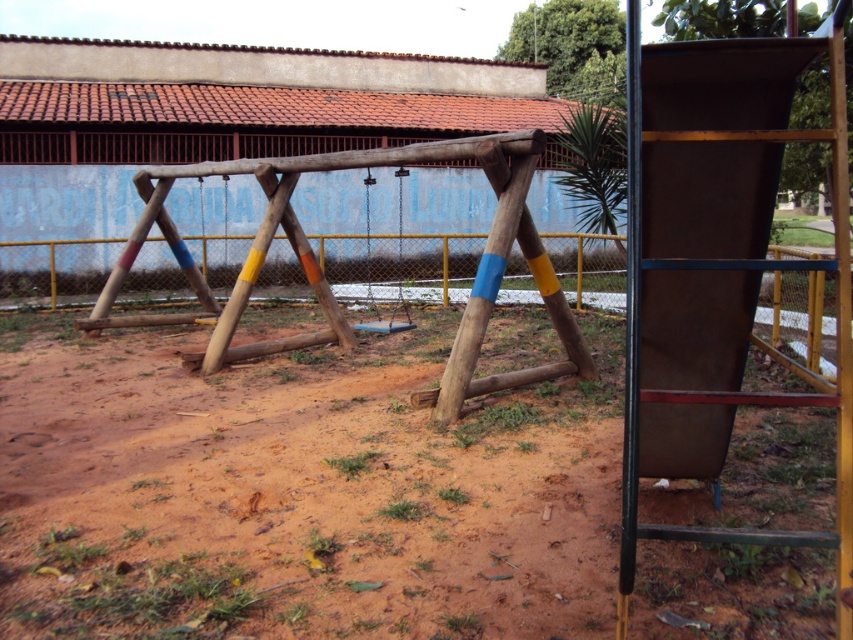
Does point (567, 484) come farther from viewer compared to point (408, 317)?

No, (567, 484) is in front of (408, 317).

Between brown dirt field at center and blue matte swing at center, which one appears on the left side from the viewer's perspective?

Positioned to the left is blue matte swing at center.

Image resolution: width=853 pixels, height=640 pixels. I want to click on brown dirt field at center, so click(299, 492).

Who is lower down, brown dirt field at center or brown matte ladder at right?

brown dirt field at center is below.

Who is positioned more to the left, brown dirt field at center or brown matte ladder at right?

brown matte ladder at right is more to the left.

Where is `brown dirt field at center`? brown dirt field at center is located at coordinates (x=299, y=492).

Can you confirm if brown matte ladder at right is thinner than blue matte swing at center?

Indeed, brown matte ladder at right has a lesser width compared to blue matte swing at center.

Does brown matte ladder at right appear on the left side of blue matte swing at center?

Incorrect, brown matte ladder at right is not on the left side of blue matte swing at center.

Is point (628, 173) positioned in front of point (398, 218)?

That is True.

Where is `brown matte ladder at right`? The image size is (853, 640). brown matte ladder at right is located at coordinates (746, 332).